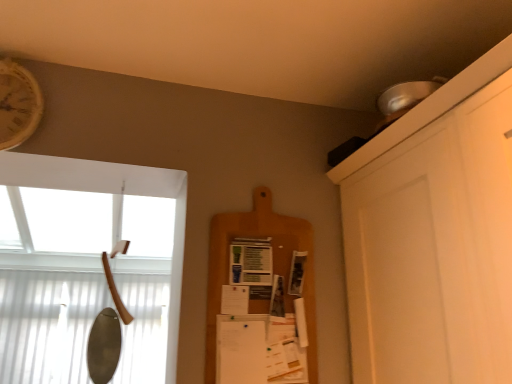
Find the location of a particular element. wooden axe handle at left is located at coordinates (87, 265).

Which is less distant, [243,319] or [2,74]?

The point [2,74] is closer.

Which of these two, wooden cutting board at center or wooden clock at upper left, is thinner?

Thinner between the two is wooden cutting board at center.

The height and width of the screenshot is (384, 512). Find the location of `clock that appears above the wooden cutting board at center (from a real-world perspective)`. clock that appears above the wooden cutting board at center (from a real-world perspective) is located at coordinates (18, 104).

Looking at this image, how many degrees apart are the facing directions of wooden cutting board at center and wooden axe handle at left?

The angular difference between wooden cutting board at center and wooden axe handle at left is 0.322 degrees.

Which point is more forward, (x=240, y=365) or (x=122, y=323)?

Positioned in front is point (x=240, y=365).

From a real-world perspective, which is physically below, wooden cutting board at center or wooden axe handle at left?

wooden cutting board at center.

Is wooden cutting board at center to the left or to the right of wooden axe handle at left in the image?

In the image, wooden cutting board at center appears on the right side of wooden axe handle at left.

Can you confirm if wooden clock at upper left is taller than wooden axe handle at left?

No, wooden clock at upper left is not taller than wooden axe handle at left.

Is wooden clock at upper left oriented towards wooden axe handle at left?

No.

From a real-world perspective, between wooden clock at upper left and wooden axe handle at left, who is vertically higher?

In real-world perspective, wooden clock at upper left is above.

Is wooden clock at upper left behind wooden axe handle at left?

Yes, wooden clock at upper left is behind wooden axe handle at left.

Which of these two, wooden axe handle at left or wooden cutting board at center, stands shorter?

With less height is wooden cutting board at center.

Between wooden axe handle at left and wooden cutting board at center, which one appears on the right side from the viewer's perspective?

From the viewer's perspective, wooden cutting board at center appears more on the right side.

From the image's perspective, is wooden axe handle at left on wooden cutting board at center?

No.

Which object is closer to the camera, wooden axe handle at left or wooden clock at upper left?

wooden axe handle at left is in front.

Who is smaller, wooden axe handle at left or wooden clock at upper left?

wooden clock at upper left.

Can you see wooden axe handle at left touching wooden clock at upper left?

wooden axe handle at left and wooden clock at upper left are clearly separated.

In terms of height, does wooden clock at upper left look taller or shorter compared to wooden cutting board at center?

wooden clock at upper left is shorter than wooden cutting board at center.

Considering the relative positions of wooden clock at upper left and wooden cutting board at center in the image provided, is wooden clock at upper left to the left of wooden cutting board at center from the viewer's perspective?

Yes.

Based on the photo, is wooden clock at upper left positioned with its back to wooden cutting board at center?

No, wooden cutting board at center is not at the back of wooden clock at upper left.

Is wooden clock at upper left further to the viewer compared to wooden cutting board at center?

No.

Locate an element on the screen. clock above the wooden cutting board at center (from a real-world perspective) is located at coordinates (18, 104).

The image size is (512, 384). Find the location of `shelf behind the wooden axe handle at left`. shelf behind the wooden axe handle at left is located at coordinates (259, 297).

Estimate the real-world distances between objects in this image. Which object is closer to wooden cutting board at center, wooden clock at upper left or wooden axe handle at left?

Based on the image, wooden clock at upper left appears to be nearer to wooden cutting board at center.

Estimate the real-world distances between objects in this image. Which object is closer to wooden clock at upper left, wooden cutting board at center or wooden axe handle at left?

wooden cutting board at center.

Based on their spatial positions, is wooden axe handle at left or wooden cutting board at center closer to wooden clock at upper left?

Among the two, wooden cutting board at center is located nearer to wooden clock at upper left.

Which object lies further to the anchor point wooden axe handle at left, wooden cutting board at center or wooden clock at upper left?

Based on the image, wooden cutting board at center appears to be further to wooden axe handle at left.

From the image, which object appears to be farther from wooden cutting board at center, wooden axe handle at left or wooden clock at upper left?

Based on the image, wooden axe handle at left appears to be further to wooden cutting board at center.

From the picture: Estimate the real-world distances between objects in this image. Which object is further from wooden axe handle at left, wooden clock at upper left or wooden cutting board at center?

wooden cutting board at center is positioned further to the anchor wooden axe handle at left.

Locate an element on the screen. The image size is (512, 384). window between wooden clock at upper left and wooden cutting board at center is located at coordinates (87, 265).